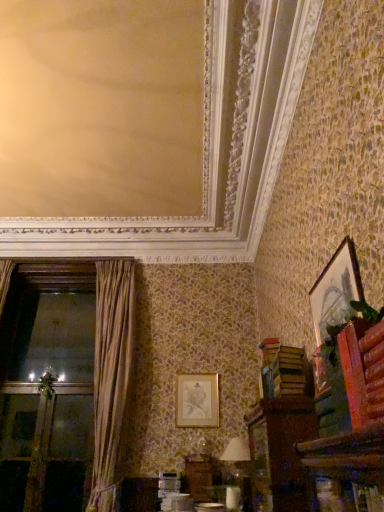
Question: Considering the relative sizes of gold-framed picture at upper right, which is the 1th picture frame from front to back, and white fabric lampshade at lower center in the image provided, is gold-framed picture at upper right, which is the 1th picture frame from front to back, thinner than white fabric lampshade at lower center?

Choices:
 (A) yes
 (B) no

Answer: (A)

Question: Considering the relative positions of gold-framed picture at upper right, the second picture frame when ordered from back to front, and white fabric lampshade at lower center in the image provided, is gold-framed picture at upper right, the second picture frame when ordered from back to front, to the left of white fabric lampshade at lower center from the viewer's perspective?

Choices:
 (A) yes
 (B) no

Answer: (B)

Question: Can you confirm if gold-framed picture at upper right, positioned as the second picture frame in left-to-right order, is bigger than white fabric lampshade at lower center?

Choices:
 (A) yes
 (B) no

Answer: (B)

Question: Does gold-framed picture at upper right, positioned as the second picture frame in left-to-right order, come behind white fabric lampshade at lower center?

Choices:
 (A) yes
 (B) no

Answer: (B)

Question: Is gold-framed picture at upper right, which is the 1th picture frame from front to back, far from white fabric lampshade at lower center?

Choices:
 (A) no
 (B) yes

Answer: (B)

Question: Is gold-framed picture at upper right, the 1th picture frame viewed from the right, closer to camera compared to white fabric lampshade at lower center?

Choices:
 (A) yes
 (B) no

Answer: (A)

Question: Is green leafy plant at upper right looking in the opposite direction of brown velvet curtain at left?

Choices:
 (A) yes
 (B) no

Answer: (B)

Question: From the image's perspective, is green leafy plant at upper right on brown velvet curtain at left?

Choices:
 (A) no
 (B) yes

Answer: (B)

Question: Considering the relative sizes of green leafy plant at upper right and brown velvet curtain at left in the image provided, is green leafy plant at upper right thinner than brown velvet curtain at left?

Choices:
 (A) yes
 (B) no

Answer: (A)

Question: Is green leafy plant at upper right shorter than brown velvet curtain at left?

Choices:
 (A) no
 (B) yes

Answer: (B)

Question: From a real-world perspective, does green leafy plant at upper right stand above brown velvet curtain at left?

Choices:
 (A) yes
 (B) no

Answer: (B)

Question: Does green leafy plant at upper right come behind brown velvet curtain at left?

Choices:
 (A) no
 (B) yes

Answer: (A)

Question: Does white fabric lampshade at lower center lie in front of green leafy plant at upper right?

Choices:
 (A) yes
 (B) no

Answer: (B)